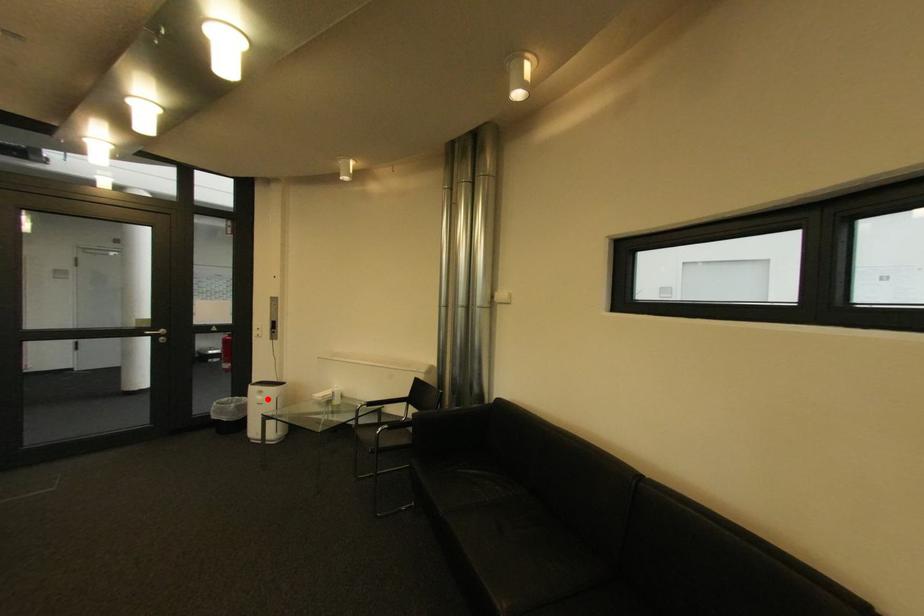
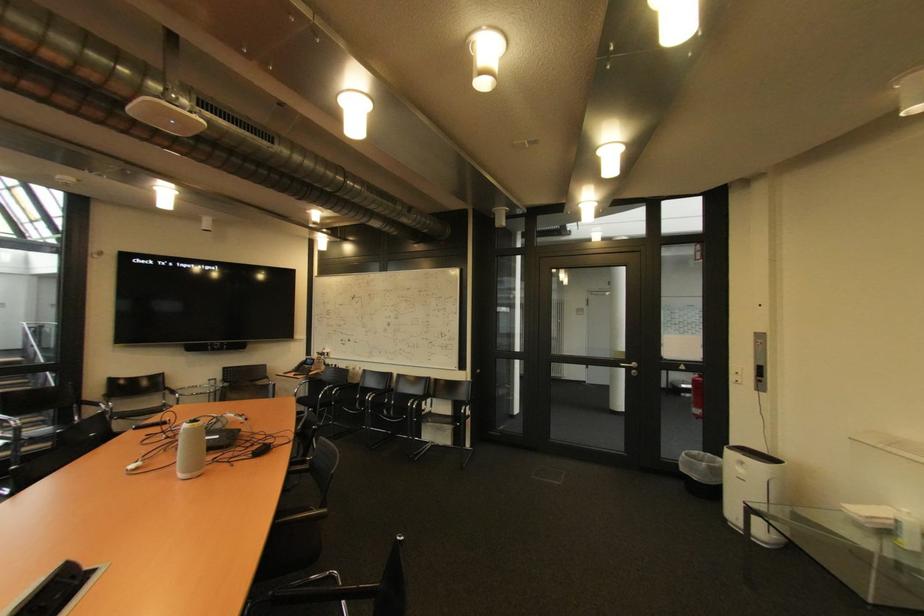
Question: A red point is marked in image1. In image2, is the corresponding 3D point closer to the camera or farther? Reply with the corresponding letter.

Choices:
 (A) The corresponding 3D point is closer.
 (B) The corresponding 3D point is farther.

Answer: (A)